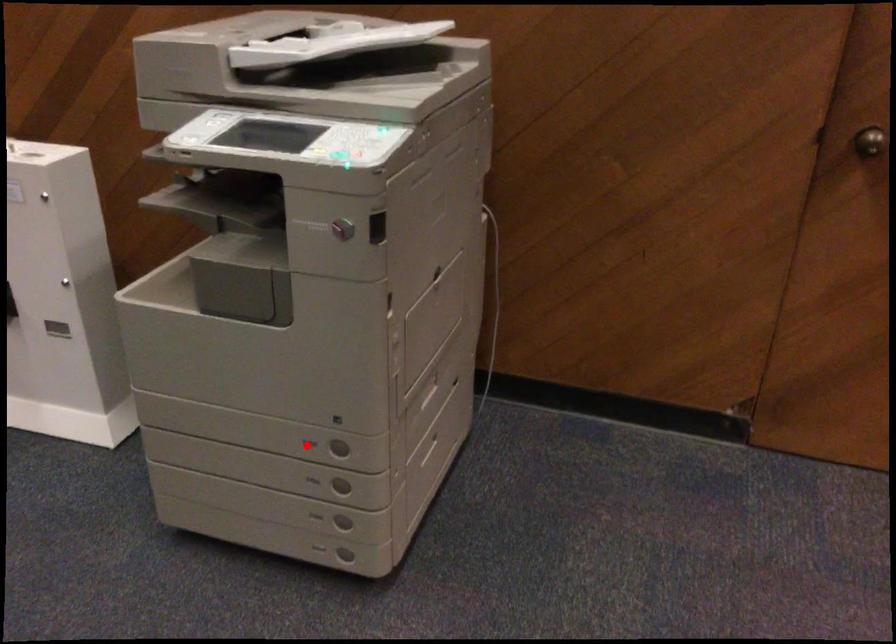
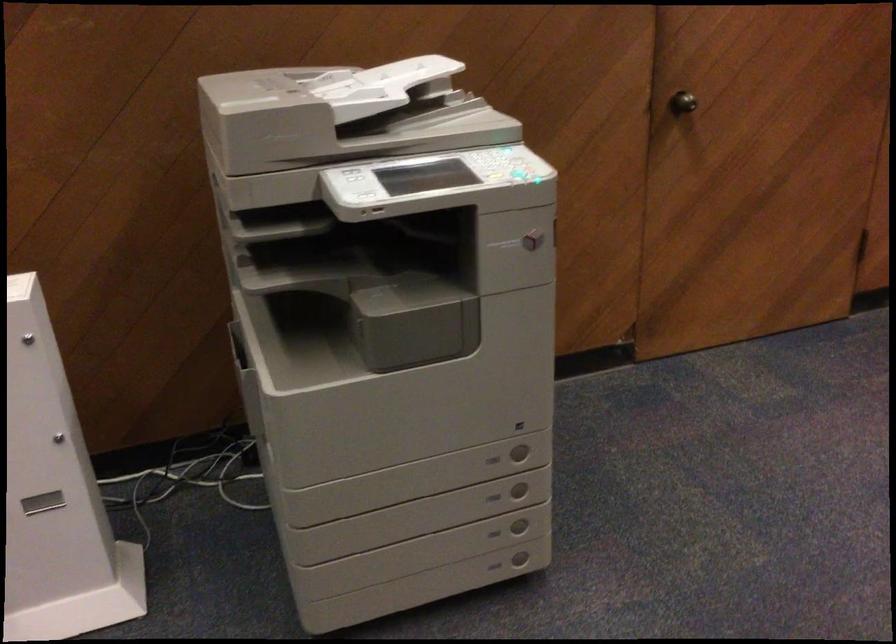
Find the pixel in the second image that matches the highlighted location in the first image.

(492, 459)